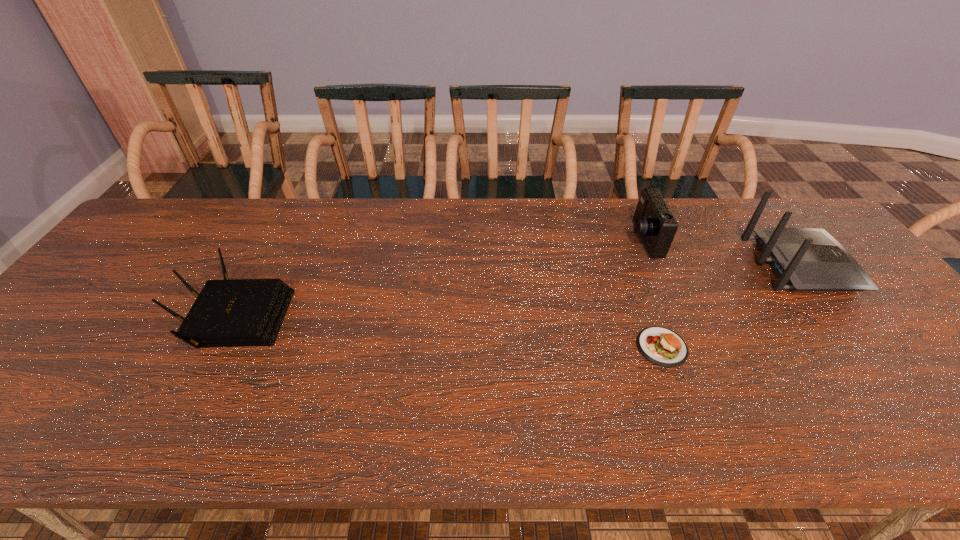
The height and width of the screenshot is (540, 960). I want to click on the second closest object to the shorter router, so click(654, 222).

Find the location of a particular element. This screenshot has height=540, width=960. free space that satisfies the following two spatial constraints: 1. on the front-facing side of the camera; 2. on the front side of the shorter router is located at coordinates (676, 316).

The image size is (960, 540). I want to click on blank space that satisfies the following two spatial constraints: 1. on the front-facing side of the rightmost object; 2. on the front-facing side of the camera, so click(x=780, y=240).

You are a GUI agent. You are given a task and a screenshot of the screen. Output one action in this format:
    pyautogui.click(x=<x>, y=<y>)
    Task: Click on the vacant space that satisfies the following two spatial constraints: 1. on the back side of the shortest object; 2. on the front-facing side of the taller router
    The image size is (960, 540).
    Given the screenshot: What is the action you would take?
    pyautogui.click(x=632, y=265)

I want to click on vacant point that satisfies the following two spatial constraints: 1. on the front-facing side of the rightmost object; 2. on the front-facing side of the camera, so click(x=780, y=240).

Identify the location of free space in the image that satisfies the following two spatial constraints: 1. on the front-facing side of the camera; 2. on the front-facing side of the tallest object. This screenshot has width=960, height=540. (654, 265).

Locate an element on the screen. This screenshot has width=960, height=540. free location that satisfies the following two spatial constraints: 1. on the front side of the shortest object; 2. on the left side of the leftmost object is located at coordinates (220, 347).

Find the location of a particular element. This screenshot has width=960, height=540. free region that satisfies the following two spatial constraints: 1. on the front-facing side of the camera; 2. on the front-facing side of the rightmost object is located at coordinates (654, 265).